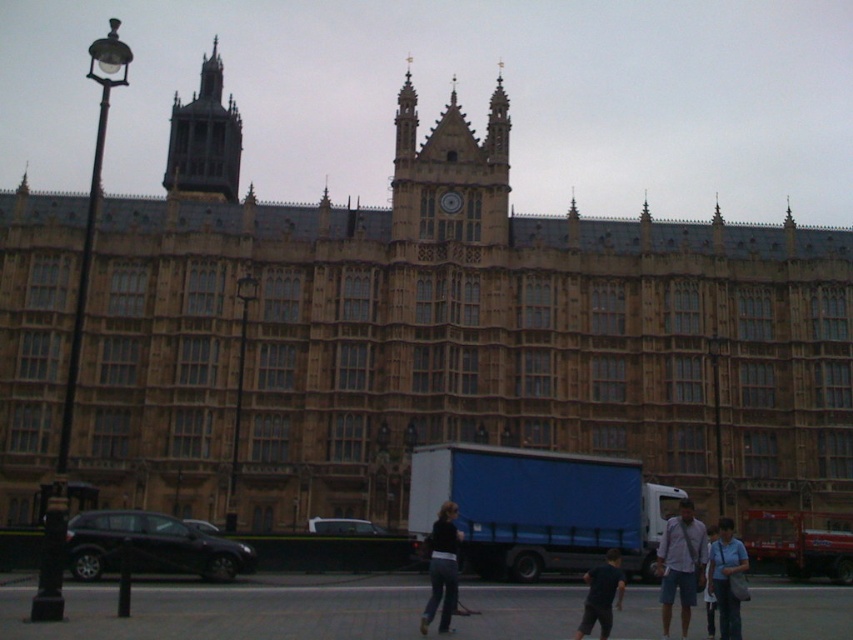
Question: Does dark gray stone tower at upper left have a larger size compared to light blue shirt at center?

Choices:
 (A) yes
 (B) no

Answer: (A)

Question: Which is farther from the dark blue shirt at center?

Choices:
 (A) dark blue jeans at center
 (B) blue fabric shirt at center

Answer: (A)

Question: Estimate the real-world distances between objects in this image. Which object is closer to the dark gray stone tower at upper left?

Choices:
 (A) gold metallic clock at center
 (B) light blue shirt at center

Answer: (A)

Question: Is blue fabric shirt at center closer to the viewer compared to gold metallic clock at center?

Choices:
 (A) yes
 (B) no

Answer: (A)

Question: Based on their relative distances, which object is farther from the gold metallic clock at center?

Choices:
 (A) light blue shirt at center
 (B) dark blue shirt at center
 (C) dark blue jeans at center
 (D) blue fabric shirt at center

Answer: (D)

Question: Can you confirm if dark blue shirt at center is bigger than gold metallic clock at center?

Choices:
 (A) no
 (B) yes

Answer: (B)